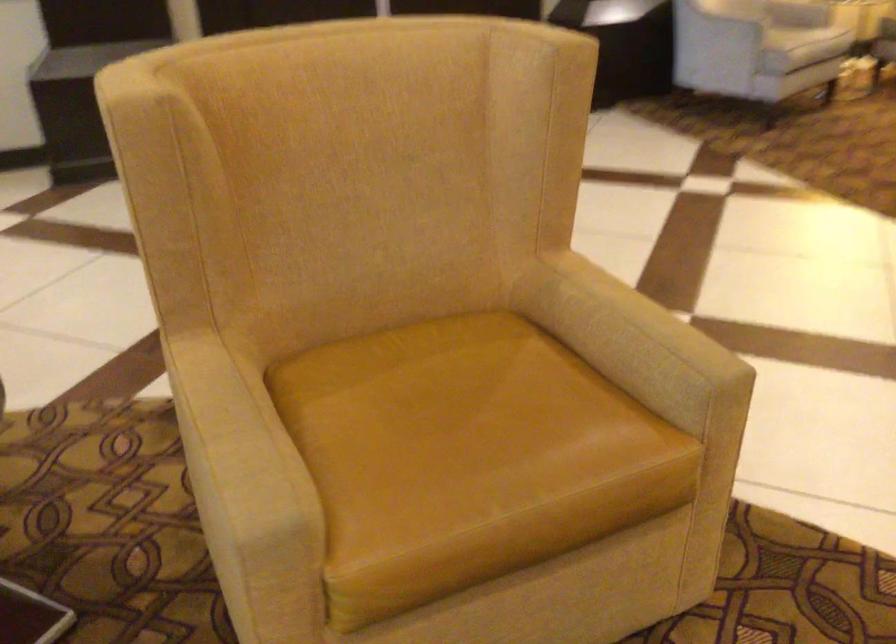
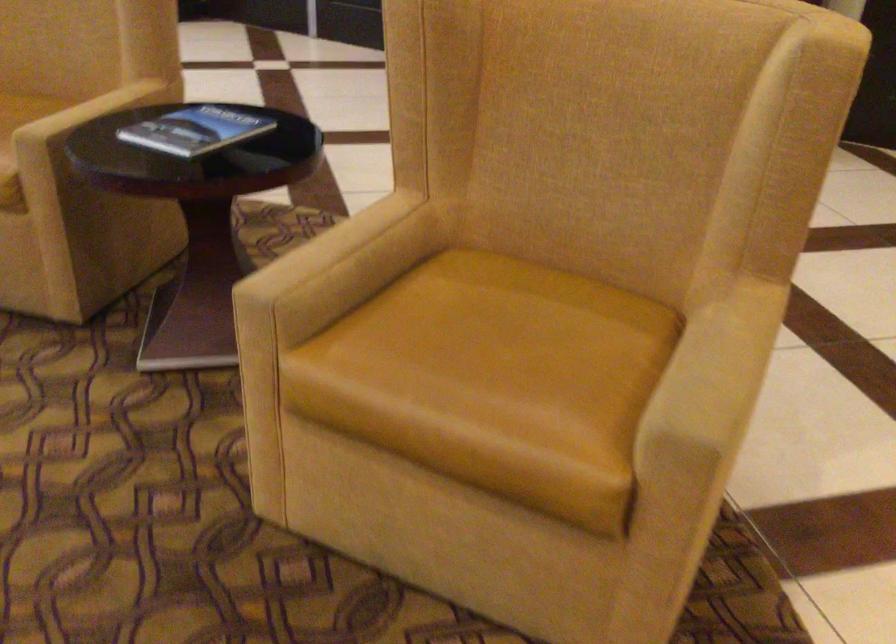
Question: The images are taken continuously from a first-person perspective. In which direction is your viewpoint rotating?

Choices:
 (A) Left
 (B) Right
 (C) Up
 (D) Down

Answer: (A)